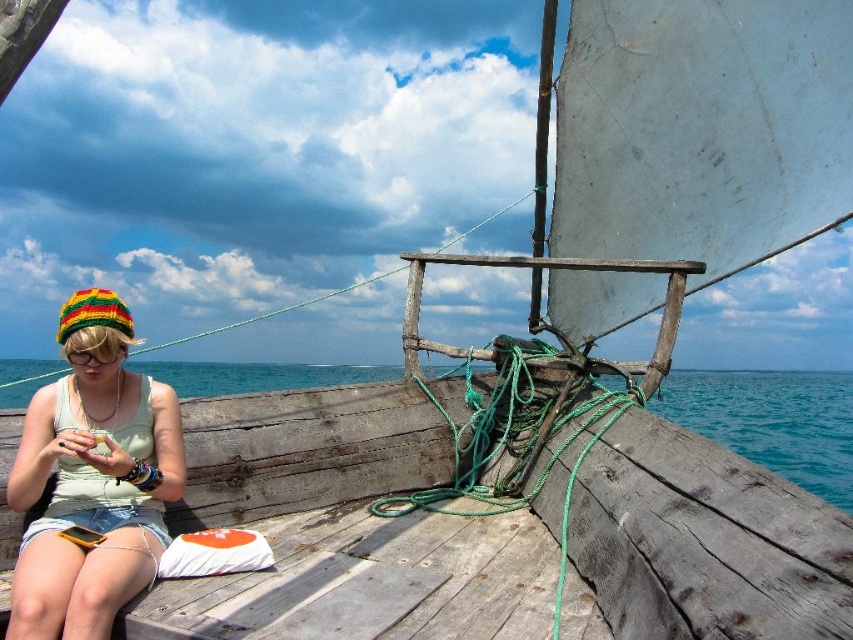
Question: Which is farther from the blue water at lower left?

Choices:
 (A) knitted multicolored hat at left
 (B) clear plastic goggles at left

Answer: (A)

Question: Which point is closer to the camera taking this photo?

Choices:
 (A) (180, 493)
 (B) (747, 442)

Answer: (A)

Question: Which point appears closest to the camera in this image?

Choices:
 (A) (120, 349)
 (B) (86, 625)
 (C) (184, 396)

Answer: (B)

Question: Is knitted multicolored hat at left further to camera compared to clear plastic goggles at left?

Choices:
 (A) no
 (B) yes

Answer: (A)

Question: Is blue water at lower left thinner than clear plastic goggles at left?

Choices:
 (A) yes
 (B) no

Answer: (B)

Question: Can you confirm if knitted multicolored hat at left is positioned above clear plastic goggles at left?

Choices:
 (A) yes
 (B) no

Answer: (B)